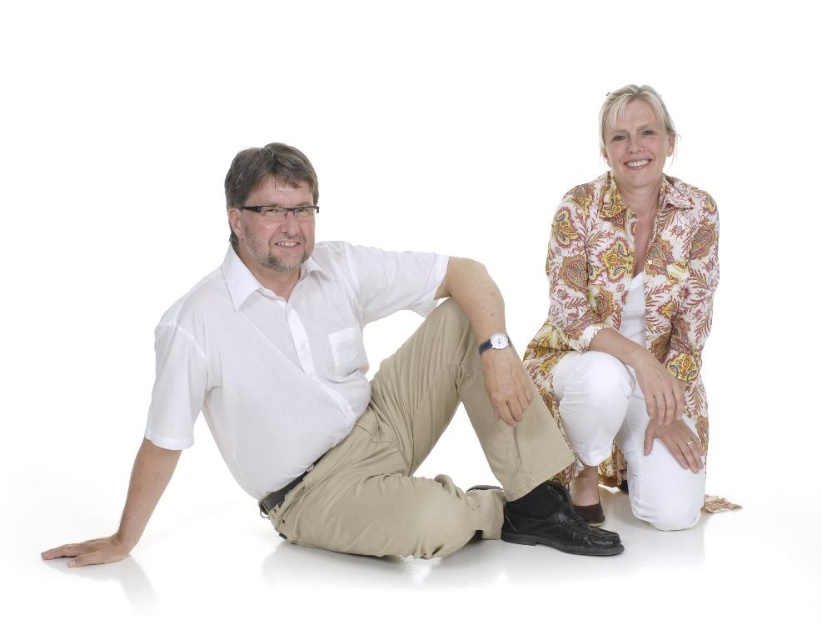
Question: Can you confirm if white smooth shirt at left is wider than khaki pants at center?

Choices:
 (A) no
 (B) yes

Answer: (A)

Question: Which of the following is the farthest from the observer?

Choices:
 (A) white cotton shirt at left
 (B) khaki pants at center
 (C) printed fabric blouse at upper right

Answer: (C)

Question: Which point is closer to the camera taking this photo?

Choices:
 (A) pos(479,268)
 (B) pos(455,488)
 (C) pos(557,394)
 (D) pos(306,451)

Answer: (B)

Question: Which point is farther to the camera?

Choices:
 (A) (432, 499)
 (B) (289, 419)
 (C) (395, 468)
 (D) (661, 371)

Answer: (D)

Question: Does printed fabric blouse at upper right appear over white smooth shirt at left?

Choices:
 (A) no
 (B) yes

Answer: (B)

Question: Can you confirm if white cotton shirt at left is smaller than printed fabric blouse at upper right?

Choices:
 (A) no
 (B) yes

Answer: (A)